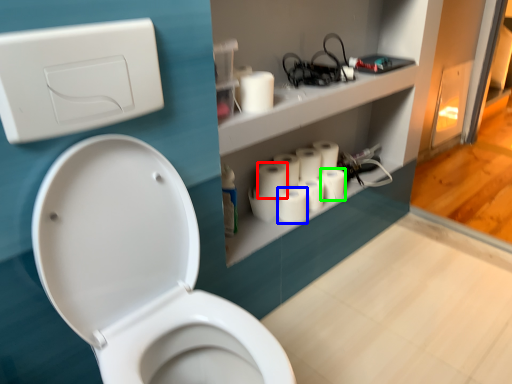
Question: Based on their relative distances, which object is nearer to toilet paper (highlighted by a red box)? Choose from toilet paper (highlighted by a blue box) and toilet paper (highlighted by a green box).

Choices:
 (A) toilet paper
 (B) toilet paper

Answer: (A)